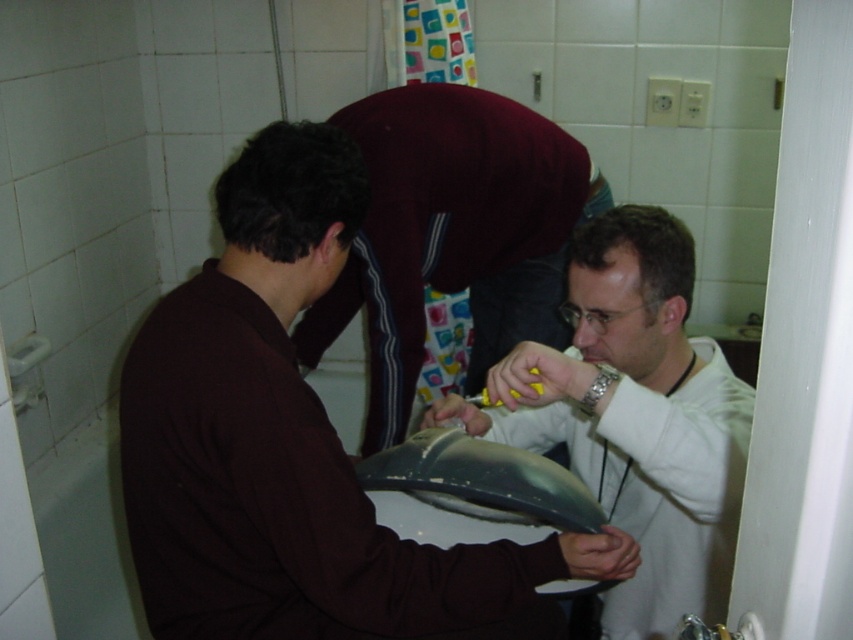
Question: Where is matte black laptop at center located in relation to maroon fabric shirt at center in the image?

Choices:
 (A) below
 (B) above

Answer: (A)

Question: Considering the real-world distances, which object is closest to the matte black laptop at center?

Choices:
 (A) maroon fabric shirt at center
 (B) metallic silver laptop at center

Answer: (B)

Question: Does matte black laptop at center have a lesser width compared to metallic silver laptop at center?

Choices:
 (A) yes
 (B) no

Answer: (B)

Question: Estimate the real-world distances between objects in this image. Which object is closer to the matte black laptop at center?

Choices:
 (A) metallic silver laptop at center
 (B) maroon fabric shirt at center

Answer: (A)

Question: Is matte black laptop at center to the left of maroon fabric shirt at center from the viewer's perspective?

Choices:
 (A) no
 (B) yes

Answer: (B)

Question: Which object is closer to the camera taking this photo?

Choices:
 (A) metallic silver laptop at center
 (B) maroon fabric shirt at center
 (C) matte black laptop at center

Answer: (C)